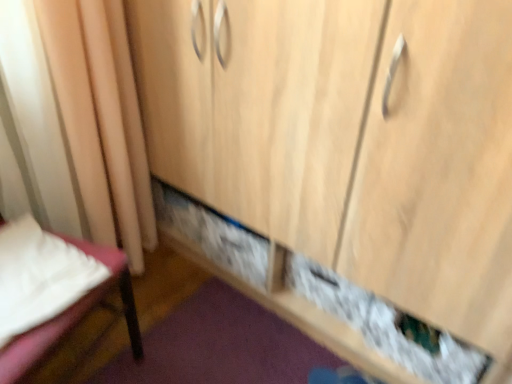
Measure the distance between point (24,91) and camera.

Point (24,91) is 1.11 meters from camera.

The width and height of the screenshot is (512, 384). What do you see at coordinates (74, 123) in the screenshot?
I see `beige fabric curtain at left` at bounding box center [74, 123].

This screenshot has height=384, width=512. What are the coordinates of `beige fabric curtain at left` in the screenshot? It's located at (74, 123).

Describe the element at coordinates (72, 318) in the screenshot. The height and width of the screenshot is (384, 512). I see `white fabric bed at lower left` at that location.

Where is `white fabric bed at lower left`? Image resolution: width=512 pixels, height=384 pixels. white fabric bed at lower left is located at coordinates (72, 318).

Identify the location of beige fabric curtain at left. click(74, 123).

Is beige fabric curtain at left at the right side of white fabric bed at lower left?

Correct, you'll find beige fabric curtain at left to the right of white fabric bed at lower left.

Which object is further away from the camera, beige fabric curtain at left or white fabric bed at lower left?

beige fabric curtain at left is further from the camera.

Is point (99, 209) farther from viewer compared to point (112, 279)?

Yes, point (99, 209) is behind point (112, 279).

From the image's perspective, which one is positioned higher, beige fabric curtain at left or white fabric bed at lower left?

beige fabric curtain at left.

From a real-world perspective, is beige fabric curtain at left under white fabric bed at lower left?

No, from a real-world perspective, beige fabric curtain at left is not beneath white fabric bed at lower left.

Which object is wider, beige fabric curtain at left or white fabric bed at lower left?

With larger width is white fabric bed at lower left.

Considering the sizes of beige fabric curtain at left and white fabric bed at lower left in the image, is beige fabric curtain at left taller or shorter than white fabric bed at lower left?

Clearly, beige fabric curtain at left is taller compared to white fabric bed at lower left.

Considering the sizes of beige fabric curtain at left and white fabric bed at lower left in the image, is beige fabric curtain at left bigger or smaller than white fabric bed at lower left?

In the image, beige fabric curtain at left appears to be larger than white fabric bed at lower left.

Is beige fabric curtain at left not inside white fabric bed at lower left?

Yes.

Can you see beige fabric curtain at left touching white fabric bed at lower left?

No, beige fabric curtain at left is not with white fabric bed at lower left.

Could you tell me if beige fabric curtain at left is turned towards white fabric bed at lower left?

No, beige fabric curtain at left is not facing towards white fabric bed at lower left.

You are a GUI agent. You are given a task and a screenshot of the screen. Output one action in this format:
    pyautogui.click(x=<x>, y=<y>)
    Task: Click on the curtain to the right of white fabric bed at lower left
    
    Given the screenshot: What is the action you would take?
    pyautogui.click(x=74, y=123)

Is white fabric bed at lower left to the left of beige fabric curtain at left from the viewer's perspective?

Yes, white fabric bed at lower left is to the left of beige fabric curtain at left.

Is white fabric bed at lower left in front of beige fabric curtain at left?

Yes, the depth of white fabric bed at lower left is less than that of beige fabric curtain at left.

Between point (75, 305) and point (75, 75), which one is positioned in front?

Point (75, 305)

From the image's perspective, does white fabric bed at lower left appear higher than beige fabric curtain at left?

Incorrect, from the image's perspective, white fabric bed at lower left is lower than beige fabric curtain at left.

From a real-world perspective, is white fabric bed at lower left physically located above or below beige fabric curtain at left?

→ In terms of real-world spatial position, white fabric bed at lower left is below beige fabric curtain at left.

In terms of width, does white fabric bed at lower left look wider or thinner when compared to beige fabric curtain at left?

white fabric bed at lower left is wider than beige fabric curtain at left.

Can you confirm if white fabric bed at lower left is taller than beige fabric curtain at left?

Incorrect, the height of white fabric bed at lower left is not larger of that of beige fabric curtain at left.

Who is bigger, white fabric bed at lower left or beige fabric curtain at left?

With larger size is beige fabric curtain at left.

Can we say white fabric bed at lower left lies outside beige fabric curtain at left?

Yes.

Is there a large distance between white fabric bed at lower left and beige fabric curtain at left?

They are positioned close to each other.

Is white fabric bed at lower left oriented towards beige fabric curtain at left?

No, white fabric bed at lower left is not oriented towards beige fabric curtain at left.

Identify the location of curtain that is on the right side of white fabric bed at lower left. The height and width of the screenshot is (384, 512). (74, 123).

Locate an element on the screen. Image resolution: width=512 pixels, height=384 pixels. curtain above the white fabric bed at lower left (from the image's perspective) is located at coordinates (74, 123).

Locate an element on the screen. This screenshot has height=384, width=512. furniture on the left of beige fabric curtain at left is located at coordinates (72, 318).